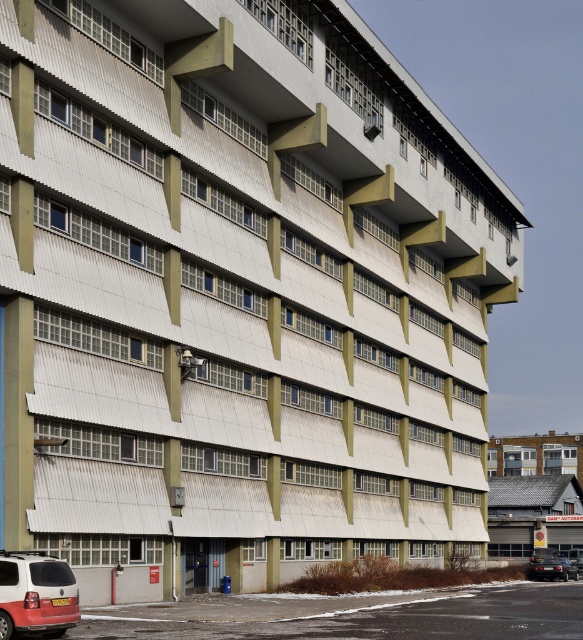
From the picture: Does white matte van at lower left come behind shiny black sedan at lower right?

No, white matte van at lower left is in front of shiny black sedan at lower right.

Does white matte van at lower left have a greater width compared to shiny black sedan at lower right?

In fact, white matte van at lower left might be narrower than shiny black sedan at lower right.

What do you see at coordinates (36, 595) in the screenshot?
I see `white matte van at lower left` at bounding box center [36, 595].

Locate an element on the screen. white matte van at lower left is located at coordinates (36, 595).

Is shiny black sedan at lower right below matte white van at lower right?

No.

Image resolution: width=583 pixels, height=640 pixels. What do you see at coordinates (556, 568) in the screenshot? I see `shiny black sedan at lower right` at bounding box center [556, 568].

Is point (543, 566) positioned behind point (570, 550)?

No, it is in front of (570, 550).

At what (x,y) coordinates should I click in order to perform the action: click on shiny black sedan at lower right. Please return your answer as a coordinate pair (x, y). This screenshot has height=640, width=583. Looking at the image, I should click on (556, 568).

Can you confirm if white matte van at lower left is smaller than matte white van at lower right?

Yes.

The image size is (583, 640). In order to click on white matte van at lower left in this screenshot , I will do `click(36, 595)`.

Who is more forward, (x=27, y=588) or (x=577, y=554)?

Point (x=27, y=588) is more forward.

What are the coordinates of `white matte van at lower left` in the screenshot? It's located at (36, 595).